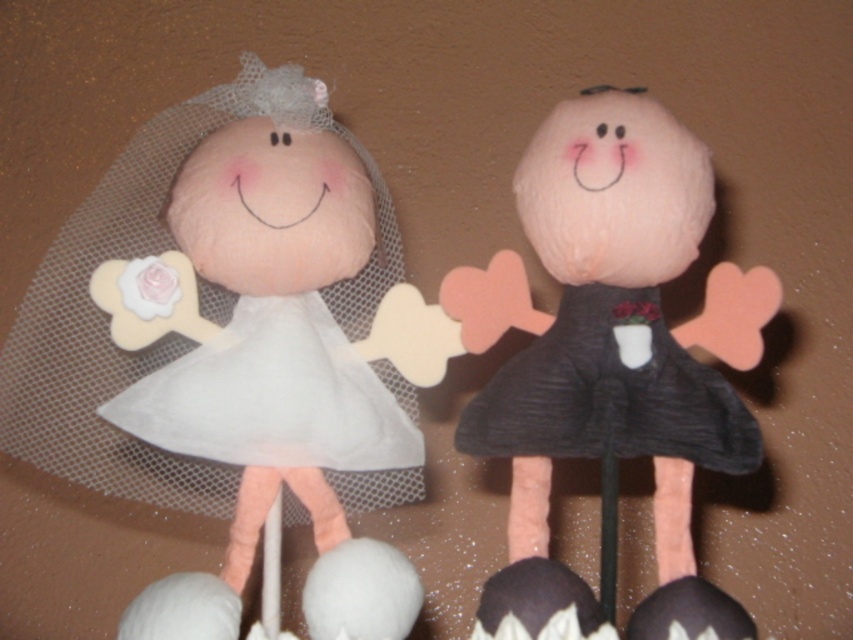
Can you confirm if white fabric doll at left is positioned to the left of matte black dress at right?

Correct, you'll find white fabric doll at left to the left of matte black dress at right.

Does white fabric doll at left have a larger size compared to matte black dress at right?

Yes, white fabric doll at left is bigger than matte black dress at right.

Who is more forward, (96, 412) or (535, 582)?

Positioned in front is point (535, 582).

Image resolution: width=853 pixels, height=640 pixels. Identify the location of white fabric doll at left. (276, 364).

Between white fabric doll at left and dark gray textured dress at right, which one appears on the left side from the viewer's perspective?

From the viewer's perspective, white fabric doll at left appears more on the left side.

Who is higher up, white fabric doll at left or dark gray textured dress at right?

white fabric doll at left

What are the coordinates of `white fabric doll at left` in the screenshot? It's located at (276, 364).

Where is `white fabric doll at left`? The image size is (853, 640). white fabric doll at left is located at coordinates (276, 364).

Is matte black dress at right shorter than dark gray textured dress at right?

No.

Is the position of matte black dress at right more distant than that of dark gray textured dress at right?

No.

Between point (529, 369) and point (492, 388), which one is positioned behind?

Positioned behind is point (492, 388).

Identify the location of matte black dress at right. (610, 362).